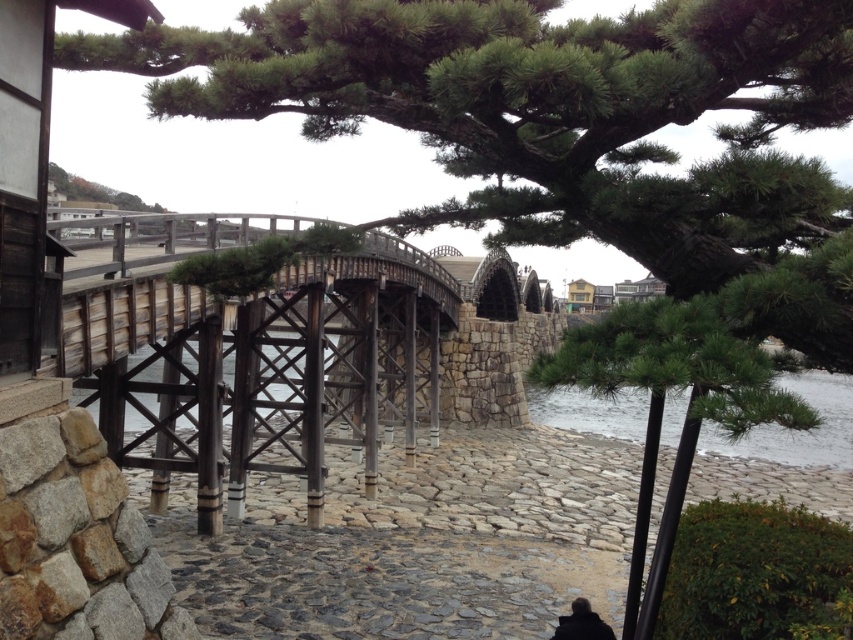
Which of these two, clear water at lower right or black matte person at lower right, stands shorter?

black matte person at lower right is shorter.

Between clear water at lower right and black matte person at lower right, which one has more height?

clear water at lower right

Who is more forward, (851, 422) or (585, 624)?

Point (585, 624) is in front.

The height and width of the screenshot is (640, 853). In order to click on clear water at lower right in this screenshot , I will do `click(798, 429)`.